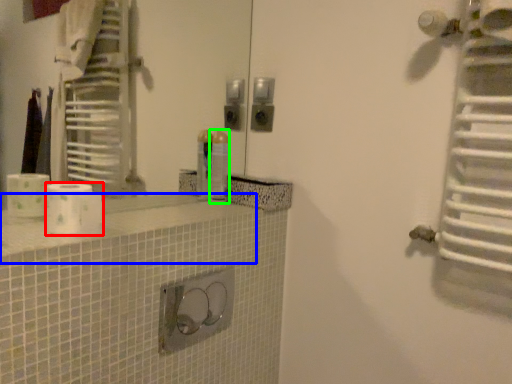
Question: Which is nearer to the toilet paper (highlighted by a red box)? counter top (highlighted by a blue box) or toiletry (highlighted by a green box).

Choices:
 (A) counter top
 (B) toiletry

Answer: (A)